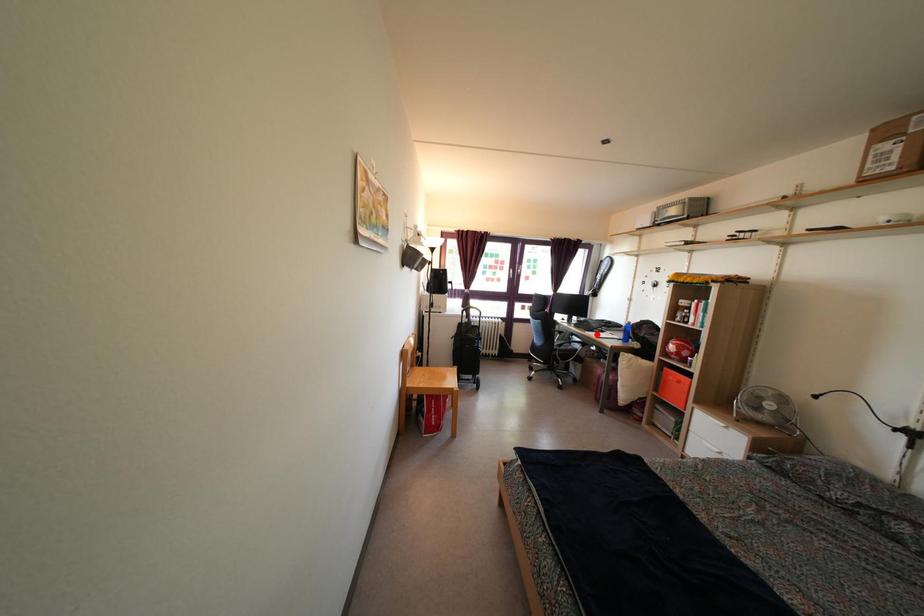
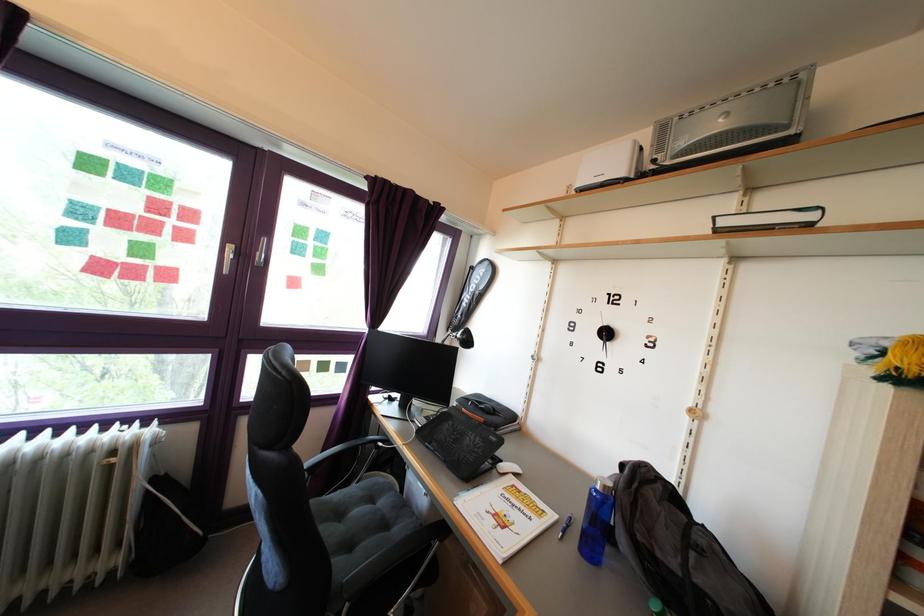
Question: I am providing you with two images of the same scene from different viewpoints. Image1 has a red point marked. In image2, the corresponding 3D location appears at what relative position? Reply with the corresponding letter.

Choices:
 (A) Closer
 (B) Farther

Answer: (B)